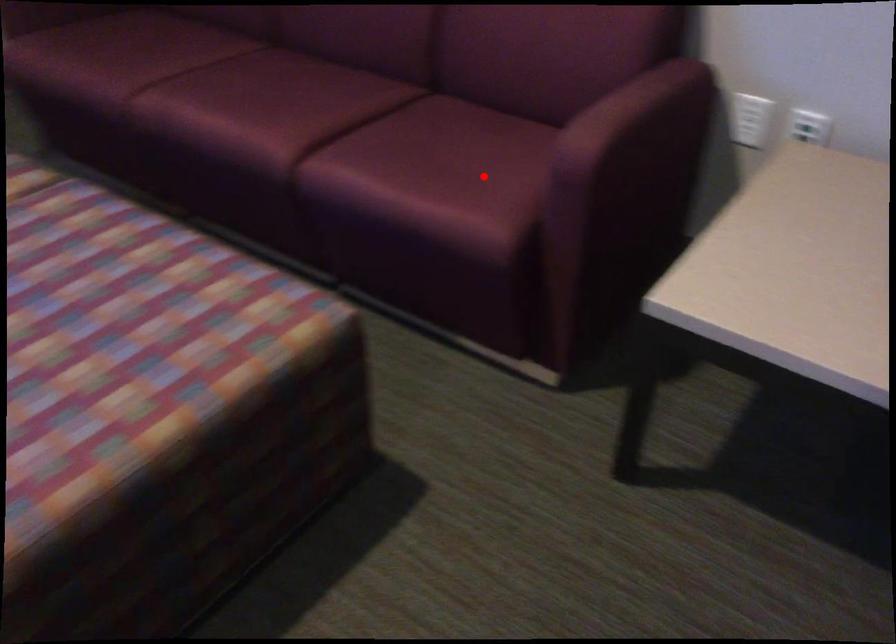
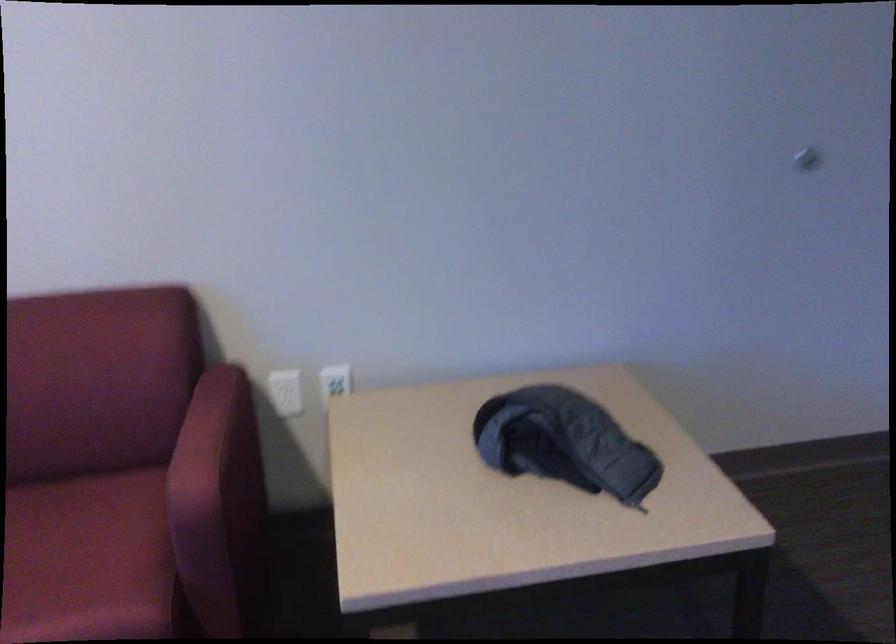
Question: I am providing you with two images of the same scene from different viewpoints. Given a red point in image1, look at the same physical point in image2. Is it:

Choices:
 (A) Closer to the viewpoint
 (B) Farther from the viewpoint

Answer: (A)